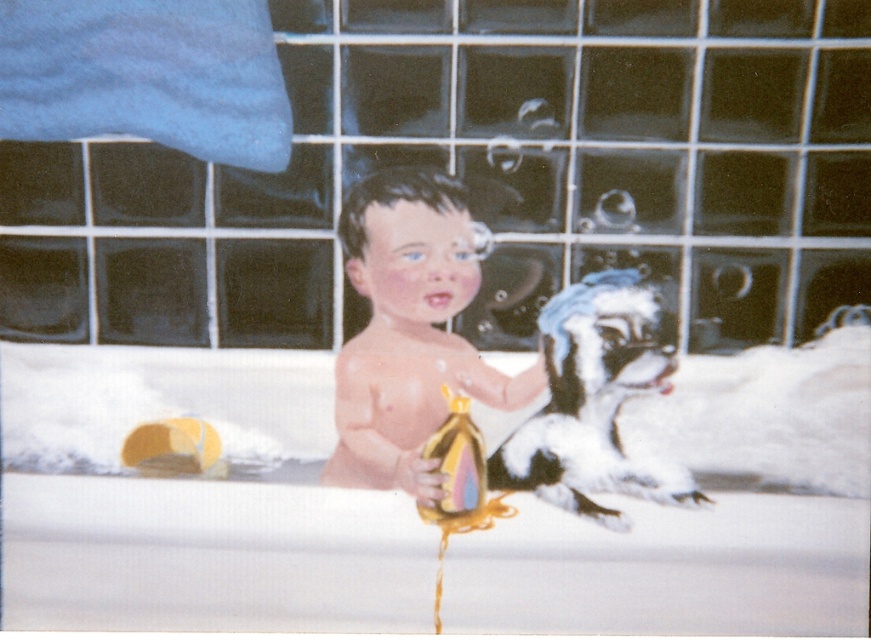
Question: Does white fur dog at center lie in front of yellow rubber duck at lower left?

Choices:
 (A) yes
 (B) no

Answer: (A)

Question: Estimate the real-world distances between objects in this image. Which object is closer to the smooth skin baby at center?

Choices:
 (A) white matte bathtub at center
 (B) white fur dog at center

Answer: (B)

Question: In this image, where is white fur dog at center located relative to yellow rubber duck at lower left?

Choices:
 (A) above
 (B) below

Answer: (A)

Question: Which of the following is the closest to the observer?

Choices:
 (A) yellow rubber duck at lower left
 (B) white matte bathtub at center

Answer: (B)

Question: Which object is the closest to the white fur dog at center?

Choices:
 (A) smooth skin baby at center
 (B) white matte bathtub at center

Answer: (A)

Question: Where is white fur dog at center located in relation to yellow rubber duck at lower left in the image?

Choices:
 (A) above
 (B) below

Answer: (A)